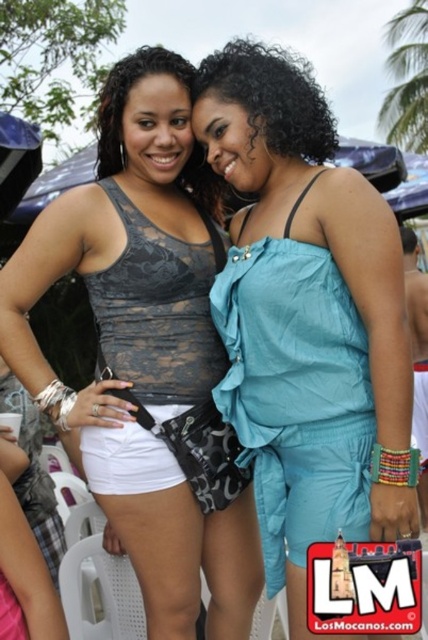
Question: Which object appears closest to the camera in this image?

Choices:
 (A) matte black tank top at center
 (B) teal satin jumpsuit at center

Answer: (B)

Question: Which point appears farthest from the camera in this image?

Choices:
 (A) (332, 522)
 (B) (190, 138)

Answer: (B)

Question: Can you confirm if teal satin jumpsuit at center is positioned to the left of matte black tank top at center?

Choices:
 (A) no
 (B) yes

Answer: (A)

Question: Does teal satin jumpsuit at center appear on the left side of matte black tank top at center?

Choices:
 (A) yes
 (B) no

Answer: (B)

Question: From the image, what is the correct spatial relationship of teal satin jumpsuit at center in relation to matte black tank top at center?

Choices:
 (A) left
 (B) right

Answer: (B)